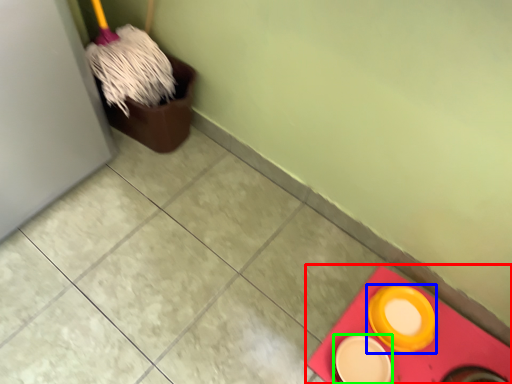
Question: Based on their relative distances, which object is farther from tile (highlighted by a red box)? Choose from tableware (highlighted by a blue box) and tableware (highlighted by a green box).

Choices:
 (A) tableware
 (B) tableware

Answer: (B)